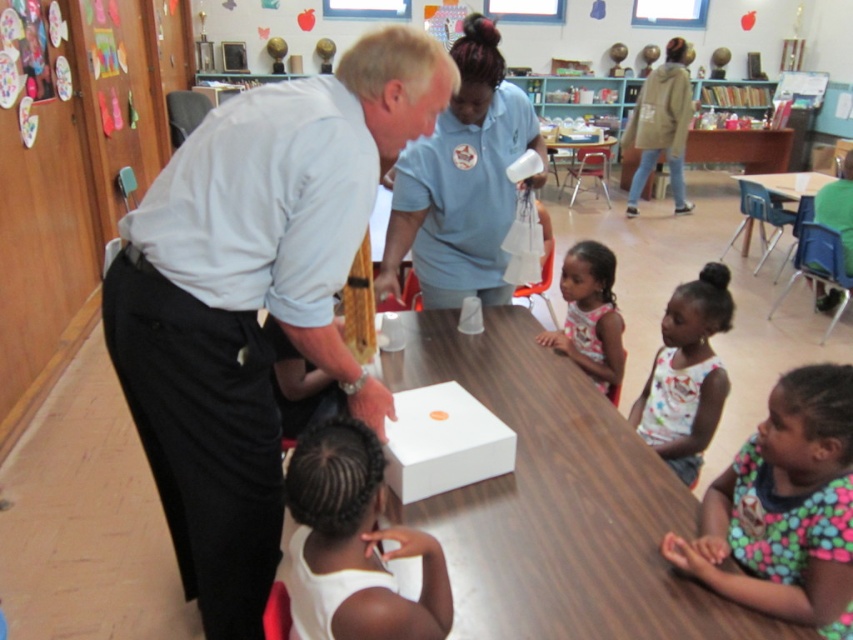
Between white matte hair at lower center and white plastic table at center, which one appears on the left side from the viewer's perspective?

From the viewer's perspective, white matte hair at lower center appears more on the left side.

Which is in front, point (402, 627) or point (575, 157)?

Point (402, 627) is in front.

The height and width of the screenshot is (640, 853). Identify the location of white matte hair at lower center. (355, 544).

Is matte blue shirt at center to the right of wooden table at right from the viewer's perspective?

In fact, matte blue shirt at center is to the left of wooden table at right.

This screenshot has height=640, width=853. In order to click on matte blue shirt at center in this screenshot , I will do `click(461, 182)`.

Who is more distant from viewer, [480,141] or [756,193]?

The point [756,193] is behind.

You are a GUI agent. You are given a task and a screenshot of the screen. Output one action in this format:
    pyautogui.click(x=<x>, y=<y>)
    Task: Click on the matte blue shirt at center
    
    Given the screenshot: What is the action you would take?
    pyautogui.click(x=461, y=182)

Can you confirm if white wood table at center is positioned to the left of white matte box at center?

Incorrect, white wood table at center is not on the left side of white matte box at center.

Is white wood table at center in front of white matte box at center?

Yes.

The width and height of the screenshot is (853, 640). What do you see at coordinates (556, 500) in the screenshot? I see `white wood table at center` at bounding box center [556, 500].

Locate an element on the screen. This screenshot has width=853, height=640. white wood table at center is located at coordinates (556, 500).